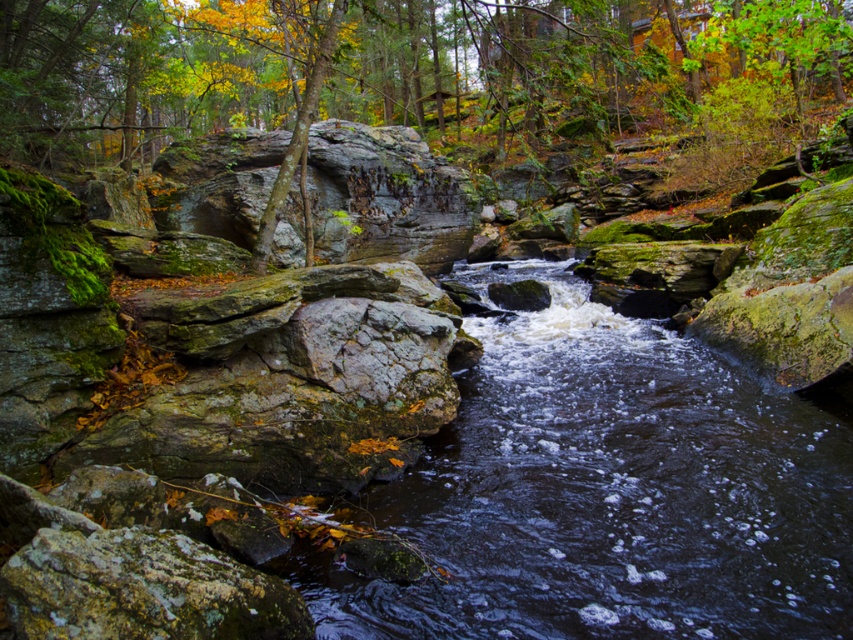
Question: Among these objects, which one is farthest from the camera?

Choices:
 (A) green mossy rock at center
 (B) smooth rock stream at center

Answer: (A)

Question: Does smooth rock stream at center appear on the right side of green mossy rock at center?

Choices:
 (A) no
 (B) yes

Answer: (B)

Question: Which object appears farthest from the camera in this image?

Choices:
 (A) green mossy rock at left
 (B) smooth rock stream at center

Answer: (A)

Question: Is smooth rock stream at center further to camera compared to green mossy rock at left?

Choices:
 (A) no
 (B) yes

Answer: (A)

Question: Which point is closer to the camera taking this photo?

Choices:
 (A) (432, 492)
 (B) (421, 252)
 (C) (784, 52)

Answer: (A)

Question: Can you confirm if green mossy rock at left is positioned above green mossy rock at center?

Choices:
 (A) yes
 (B) no

Answer: (A)